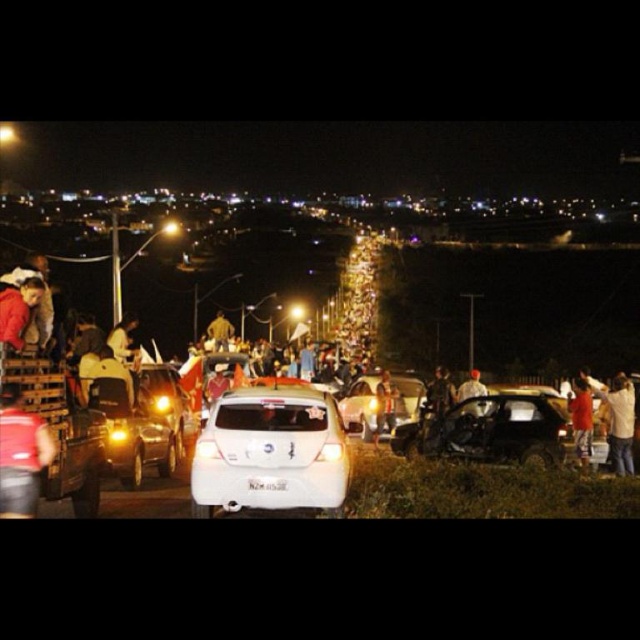
Based on the photo, does metallic silver truck at lower left have a greater width compared to shiny metallic sedan at center-left?

In fact, metallic silver truck at lower left might be narrower than shiny metallic sedan at center-left.

Can you confirm if metallic silver truck at lower left is bigger than shiny metallic sedan at center-left?

Incorrect, metallic silver truck at lower left is not larger than shiny metallic sedan at center-left.

Does point (17, 380) come in front of point (154, 385)?

That is True.

You are a GUI agent. You are given a task and a screenshot of the screen. Output one action in this format:
    pyautogui.click(x=<x>, y=<y>)
    Task: Click on the metallic silver truck at lower left
    The width and height of the screenshot is (640, 640).
    Given the screenshot: What is the action you would take?
    pyautogui.click(x=64, y=432)

Does metallic silver truck at lower left lie in front of white fabric shirt at center?

Yes, metallic silver truck at lower left is closer to the viewer.

Is point (106, 445) closer to camera compared to point (376, 422)?

That is True.

Who is more distant from viewer, (104, 465) or (392, 403)?

The point (392, 403) is behind.

You are a GUI agent. You are given a task and a screenshot of the screen. Output one action in this format:
    pyautogui.click(x=<x>, y=<y>)
    Task: Click on the metallic silver truck at lower left
    The image size is (640, 640).
    Given the screenshot: What is the action you would take?
    pyautogui.click(x=64, y=432)

Does point (346, 324) come behind point (577, 410)?

That is True.

Is illuminated plastic lights at center smaller than orange fabric shirt at right?

No, illuminated plastic lights at center is not smaller than orange fabric shirt at right.

Is point (365, 317) positioned behind point (573, 413)?

That is True.

The width and height of the screenshot is (640, 640). I want to click on illuminated plastic lights at center, so click(x=358, y=298).